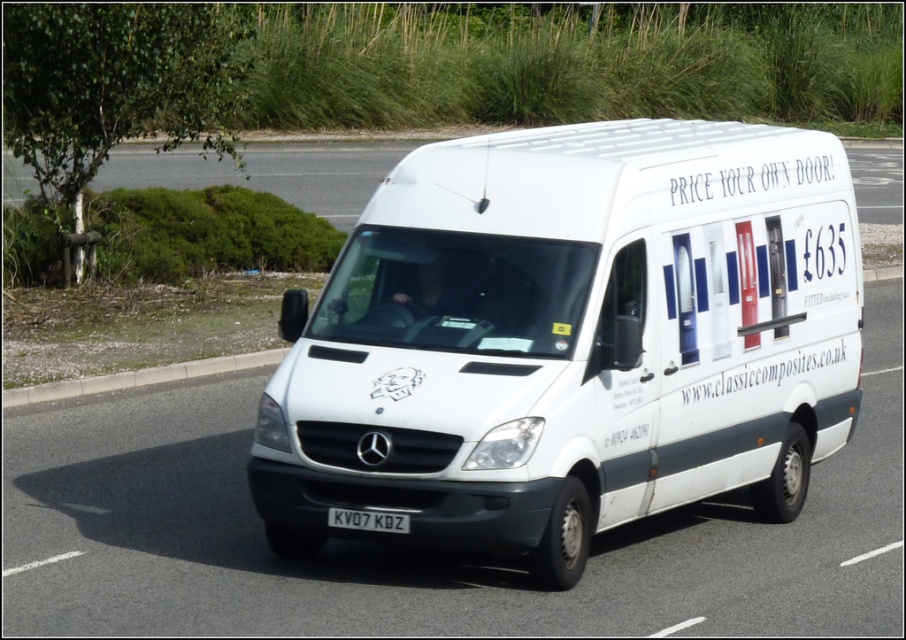
Can you confirm if white matte van at center is smaller than black metallic license plate at center?

No.

Which is behind, point (610, 292) or point (344, 524)?

Positioned behind is point (610, 292).

At what (x,y) coordinates should I click in order to perform the action: click on white matte van at center. Please return your answer as a coordinate pair (x, y). The width and height of the screenshot is (906, 640). Looking at the image, I should click on (570, 339).

Who is taller, concrete at lower left or black metallic license plate at center?

Standing taller between the two is concrete at lower left.

Is concrete at lower left to the left of black metallic license plate at center from the viewer's perspective?

Indeed, concrete at lower left is positioned on the left side of black metallic license plate at center.

Find the location of a particular element. concrete at lower left is located at coordinates (138, 378).

Where is `concrete at lower left`? The width and height of the screenshot is (906, 640). concrete at lower left is located at coordinates (138, 378).

Does white matte van at center have a lesser width compared to concrete at lower left?

No, white matte van at center is not thinner than concrete at lower left.

Which is in front, point (483, 324) or point (47, 396)?

Positioned in front is point (483, 324).

Is point (570, 342) behind point (128, 372)?

No, it is not.

You are a GUI agent. You are given a task and a screenshot of the screen. Output one action in this format:
    pyautogui.click(x=<x>, y=<y>)
    Task: Click on the white matte van at center
    Image resolution: width=906 pixels, height=640 pixels.
    Given the screenshot: What is the action you would take?
    pyautogui.click(x=570, y=339)